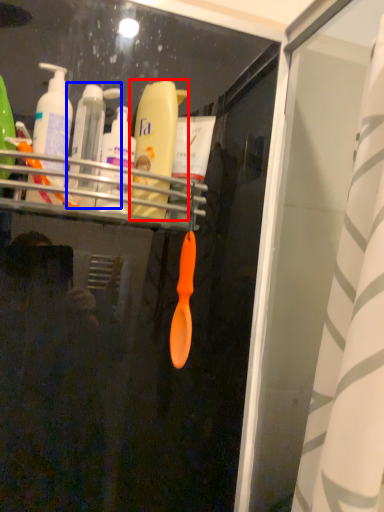
Question: Which object appears farthest to the camera in this image, bottle (highlighted by a red box) or toiletry (highlighted by a blue box)?

Choices:
 (A) bottle
 (B) toiletry

Answer: (A)